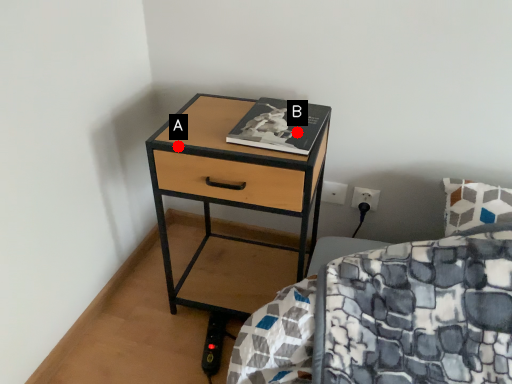
Question: Two points are circled on the image, labeled by A and B beside each circle. Which point is farther from the camera taking this photo?

Choices:
 (A) A is further
 (B) B is further

Answer: (A)